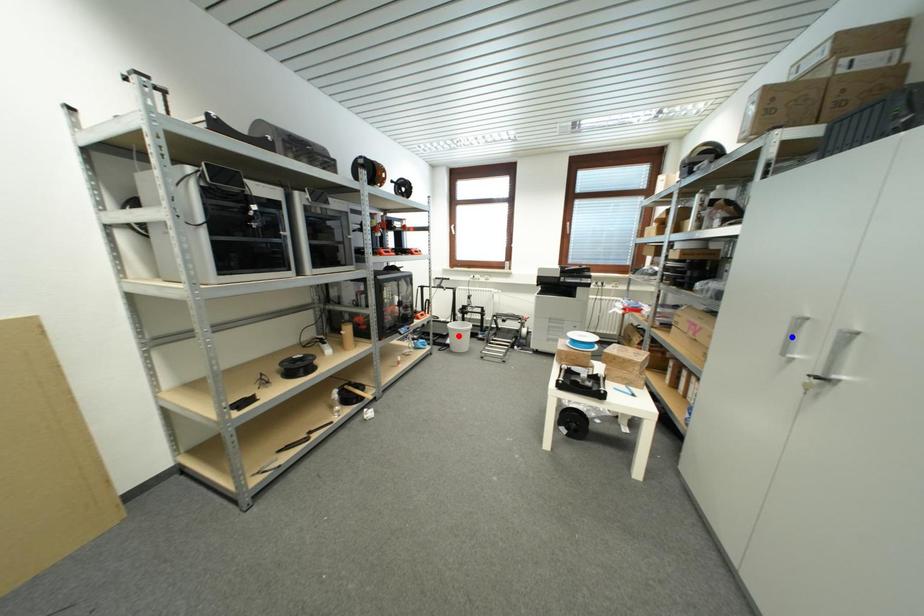
Question: Two points are marked on the image. Which point is closer to the camera?

Choices:
 (A) Blue point is closer.
 (B) Red point is closer.

Answer: (A)